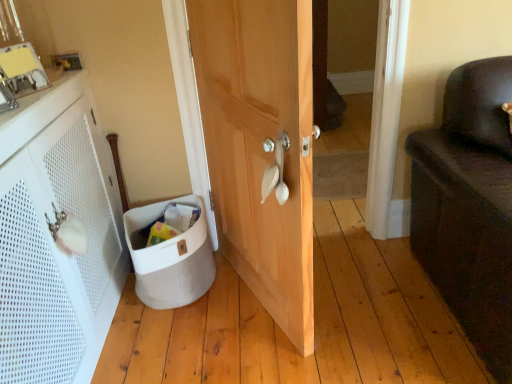
Question: Is the surface of white perforated cabinet at left in direct contact with white plastic door handle at center?

Choices:
 (A) yes
 (B) no

Answer: (B)

Question: Can you confirm if white perforated cabinet at left is positioned to the right of white plastic door handle at center?

Choices:
 (A) no
 (B) yes

Answer: (A)

Question: Considering the relative sizes of white perforated cabinet at left and white plastic door handle at center in the image provided, is white perforated cabinet at left taller than white plastic door handle at center?

Choices:
 (A) no
 (B) yes

Answer: (B)

Question: From a real-world perspective, does white perforated cabinet at left sit lower than white plastic door handle at center?

Choices:
 (A) yes
 (B) no

Answer: (A)

Question: Is white perforated cabinet at left positioned in front of white plastic door handle at center?

Choices:
 (A) yes
 (B) no

Answer: (A)

Question: Considering the relative positions of white perforated cabinet at left and white plastic door handle at center in the image provided, is white perforated cabinet at left behind white plastic door handle at center?

Choices:
 (A) no
 (B) yes

Answer: (A)

Question: Is white fabric laundry basket at lower left at the back of natural wood door at center?

Choices:
 (A) no
 (B) yes

Answer: (A)

Question: Considering the relative sizes of natural wood door at center and white fabric laundry basket at lower left in the image provided, is natural wood door at center smaller than white fabric laundry basket at lower left?

Choices:
 (A) no
 (B) yes

Answer: (A)

Question: From the image's perspective, is natural wood door at center below white fabric laundry basket at lower left?

Choices:
 (A) no
 (B) yes

Answer: (A)

Question: Is natural wood door at center far away from white fabric laundry basket at lower left?

Choices:
 (A) no
 (B) yes

Answer: (A)

Question: Is natural wood door at center completely or partially outside of white fabric laundry basket at lower left?

Choices:
 (A) yes
 (B) no

Answer: (A)

Question: Can white fabric laundry basket at lower left be found inside natural wood door at center?

Choices:
 (A) no
 (B) yes

Answer: (A)

Question: Is white fabric laundry basket at lower left shorter than natural wood door at center?

Choices:
 (A) yes
 (B) no

Answer: (A)